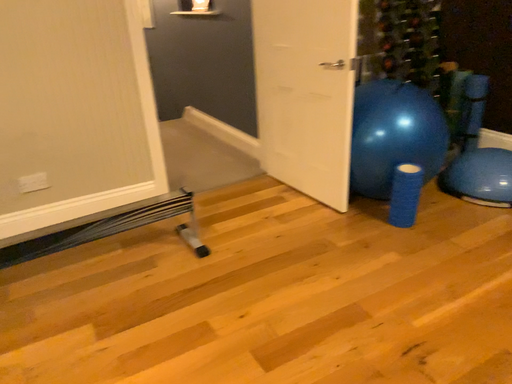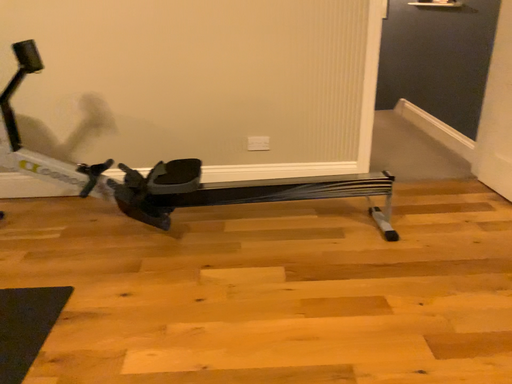
Question: How did the camera likely rotate when shooting the video?

Choices:
 (A) rotated right
 (B) rotated left

Answer: (B)